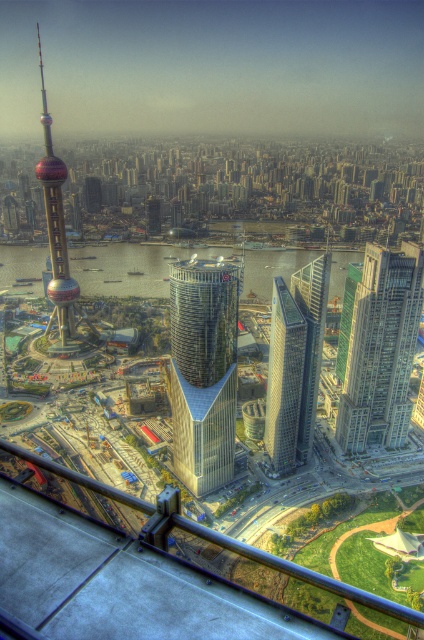
Question: Which object is closer to the camera taking this photo?

Choices:
 (A) green glass skyscraper at center-right
 (B) shiny glass tower at left

Answer: (A)

Question: Does shiny glass tower at left come behind glassy modern skyscraper at center?

Choices:
 (A) yes
 (B) no

Answer: (A)

Question: Does glassy silver skyscraper at center have a lesser width compared to glassy steel skyscraper at center?

Choices:
 (A) yes
 (B) no

Answer: (B)

Question: Among these points, which one is nearest to the camera?

Choices:
 (A) (306, 321)
 (B) (342, 444)
 (C) (61, 340)

Answer: (A)

Question: Based on their relative distances, which object is farther from the glassy silver skyscraper at center?

Choices:
 (A) glassy steel skyscraper at center
 (B) shiny glass tower at left
 (C) glassy modern skyscraper at center
 (D) green glass skyscraper at center-right

Answer: (B)

Question: Is green glass skyscraper at center-right wider than glassy steel skyscraper at center?

Choices:
 (A) no
 (B) yes

Answer: (B)